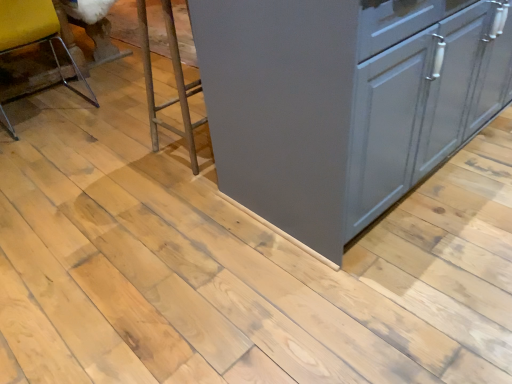
Question: Is clear plastic chair at left positioned far away from metallic silver step stool at center?

Choices:
 (A) no
 (B) yes

Answer: (A)

Question: Could you tell me if clear plastic chair at left is turned towards metallic silver step stool at center?

Choices:
 (A) yes
 (B) no

Answer: (B)

Question: Is clear plastic chair at left closer to camera compared to metallic silver step stool at center?

Choices:
 (A) no
 (B) yes

Answer: (A)

Question: Does clear plastic chair at left contain metallic silver step stool at center?

Choices:
 (A) yes
 (B) no

Answer: (B)

Question: Is clear plastic chair at left smaller than metallic silver step stool at center?

Choices:
 (A) yes
 (B) no

Answer: (B)

Question: Is satin gray cabinet at center in front of or behind metallic silver step stool at center in the image?

Choices:
 (A) behind
 (B) front

Answer: (B)

Question: In terms of size, does satin gray cabinet at center appear bigger or smaller than metallic silver step stool at center?

Choices:
 (A) big
 (B) small

Answer: (A)

Question: Is satin gray cabinet at center wider or thinner than metallic silver step stool at center?

Choices:
 (A) wide
 (B) thin

Answer: (A)

Question: From a real-world perspective, is satin gray cabinet at center physically located above or below metallic silver step stool at center?

Choices:
 (A) above
 (B) below

Answer: (A)

Question: Based on their positions, is satin gray cabinet at center located to the left or right of clear plastic chair at left?

Choices:
 (A) right
 (B) left

Answer: (A)

Question: In terms of height, does satin gray cabinet at center look taller or shorter compared to clear plastic chair at left?

Choices:
 (A) short
 (B) tall

Answer: (B)

Question: Considering the positions of satin gray cabinet at center and clear plastic chair at left in the image, is satin gray cabinet at center wider or thinner than clear plastic chair at left?

Choices:
 (A) thin
 (B) wide

Answer: (B)

Question: Considering their positions, is satin gray cabinet at center located in front of or behind clear plastic chair at left?

Choices:
 (A) front
 (B) behind

Answer: (A)

Question: In terms of size, does metallic silver step stool at center appear bigger or smaller than satin gray cabinet at center?

Choices:
 (A) big
 (B) small

Answer: (B)

Question: Considering the positions of metallic silver step stool at center and satin gray cabinet at center in the image, is metallic silver step stool at center taller or shorter than satin gray cabinet at center?

Choices:
 (A) short
 (B) tall

Answer: (A)